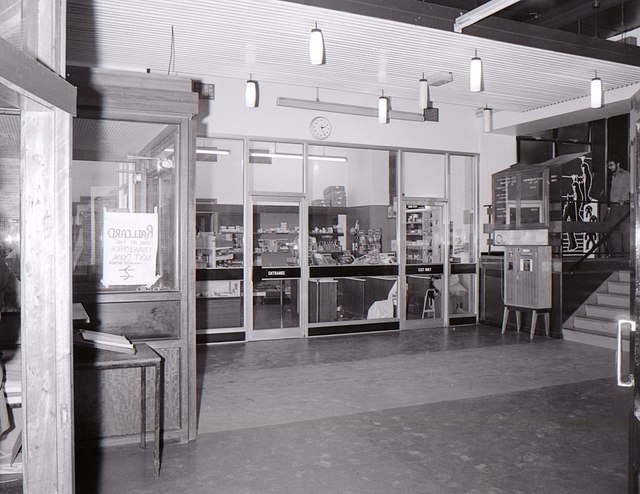
The width and height of the screenshot is (640, 494). In order to click on poster in this screenshot , I will do `click(107, 256)`.